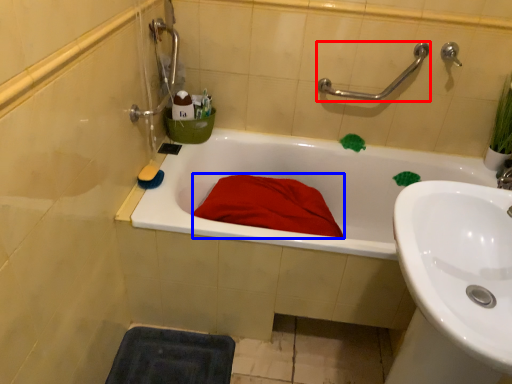
Question: Which object appears farthest to the camera in this image, shower (highlighted by a red box) or blanket (highlighted by a blue box)?

Choices:
 (A) shower
 (B) blanket

Answer: (A)